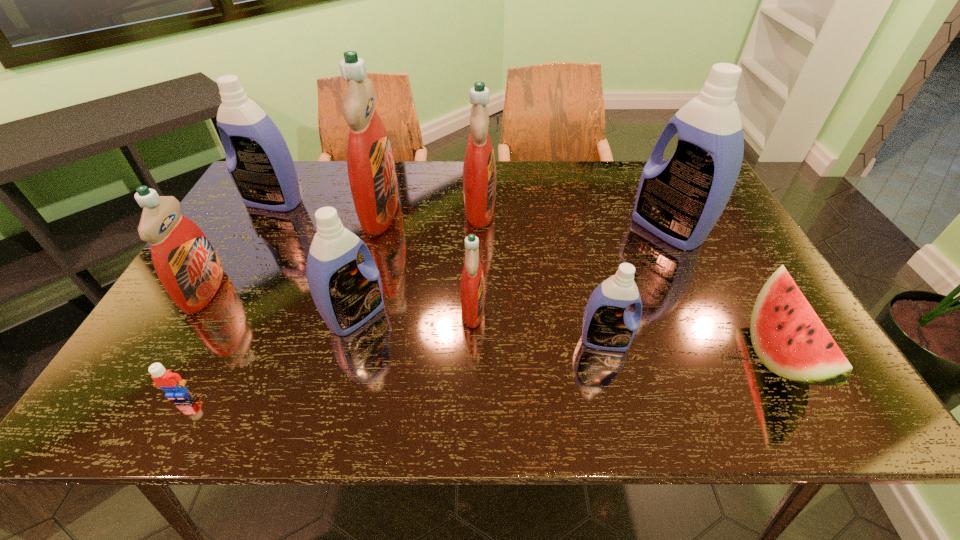
At what (x,y) coordinates should I click in order to perform the action: click on the third closest blue detergent relative to the smallest blue detergent. Please return your answer as a coordinate pair (x, y). Looking at the image, I should click on tap(261, 167).

This screenshot has width=960, height=540. What are the coordinates of `vacant space that satisfies the following two spatial constraints: 1. on the front surface of the rightmost detergent; 2. on the right side of the third smallest red detergent` in the screenshot? It's located at (480, 229).

The width and height of the screenshot is (960, 540). In order to click on free spot that satisfies the following two spatial constraints: 1. on the outer rind of the green watermelon; 2. on the face of the white Lego in this screenshot , I will do `click(800, 393)`.

This screenshot has height=540, width=960. What are the coordinates of `free spot that satisfies the following two spatial constraints: 1. on the front surface of the third smallest red detergent; 2. on the face of the Lego` in the screenshot? It's located at 479,393.

You are a GUI agent. You are given a task and a screenshot of the screen. Output one action in this format:
    pyautogui.click(x=<x>, y=<y>)
    Task: Click on the free space that satisfies the following two spatial constraints: 1. on the front surface of the biggest blue detergent; 2. on the right side of the second red detergent from left to right
    
    Given the screenshot: What is the action you would take?
    pyautogui.click(x=375, y=229)

This screenshot has width=960, height=540. In order to click on vacant space that satisfies the following two spatial constraints: 1. on the front surface of the second blue detergent from left to right; 2. on the left side of the second smallest red detergent in this screenshot , I will do `click(190, 315)`.